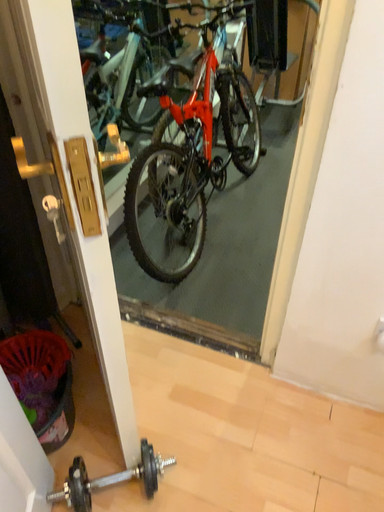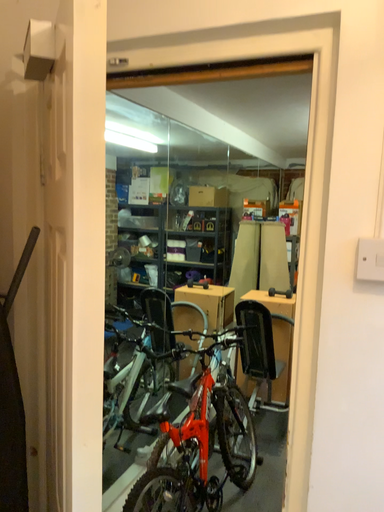
Question: Which way did the camera rotate in the video?

Choices:
 (A) rotated downward
 (B) rotated upward

Answer: (B)